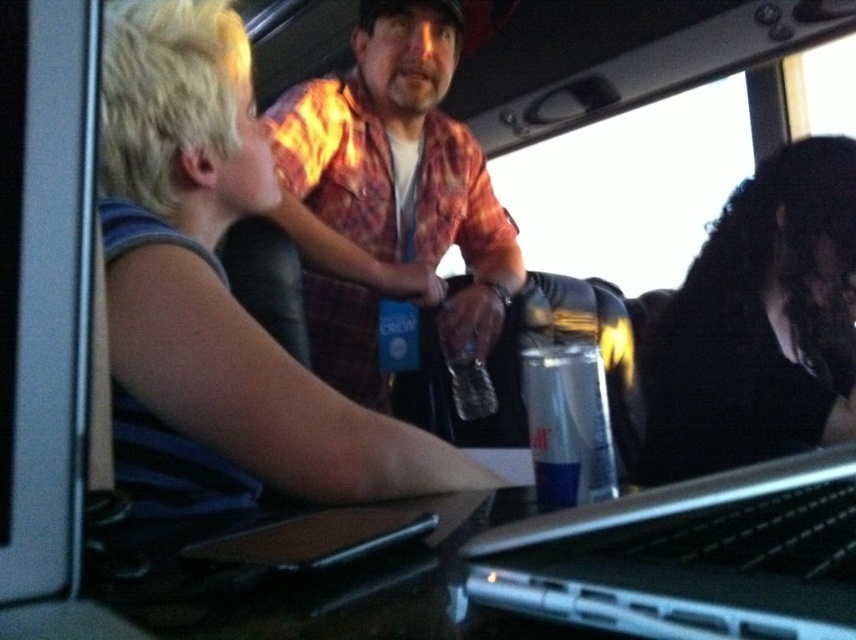
Question: Among these objects, which one is nearest to the camera?

Choices:
 (A) blonde hair at upper left
 (B) clear plastic can at center

Answer: (B)

Question: Is blonde hair at upper left to the left of black matte hair at upper right from the viewer's perspective?

Choices:
 (A) no
 (B) yes

Answer: (B)

Question: From the image, what is the correct spatial relationship of blonde hair at upper left in relation to clear plastic can at center?

Choices:
 (A) below
 (B) above

Answer: (B)

Question: Estimate the real-world distances between objects in this image. Which object is closer to the blonde hair at upper left?

Choices:
 (A) clear plastic can at center
 (B) silver metallic laptop at center

Answer: (A)

Question: Does blonde hair at upper left appear on the left side of silver metallic laptop at center?

Choices:
 (A) no
 (B) yes

Answer: (B)

Question: Which is nearer to the flannel shirt at center?

Choices:
 (A) clear plastic can at center
 (B) blonde hair at upper left
 (C) silver metallic laptop at center
 (D) black matte hair at upper right

Answer: (B)